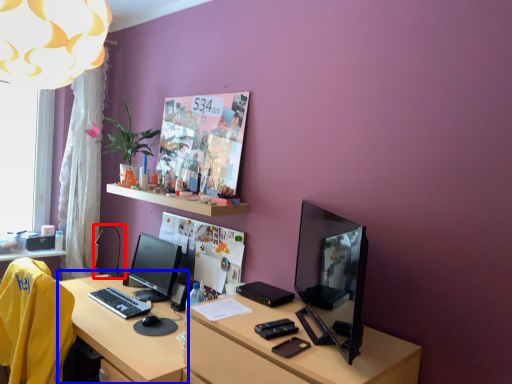
Question: Which object appears closest to the camera in this image, table lamp (highlighted by a red box) or vanity (highlighted by a blue box)?

Choices:
 (A) table lamp
 (B) vanity

Answer: (B)